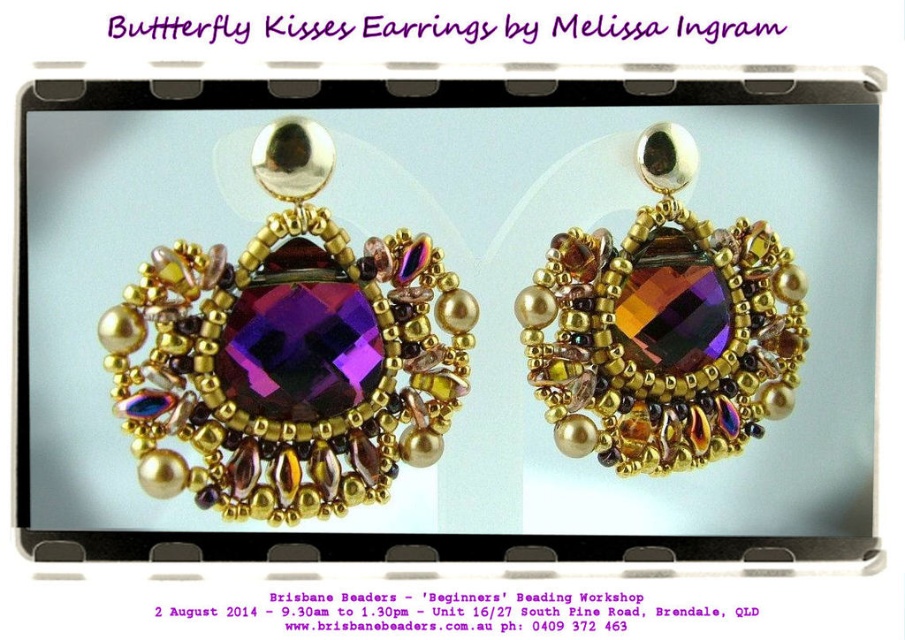
Question: Is purple faceted gemstone at center further to the viewer compared to iridescent glass heart at center?

Choices:
 (A) yes
 (B) no

Answer: (B)

Question: Can you confirm if purple faceted gemstone at center is positioned below iridescent glass heart at center?

Choices:
 (A) no
 (B) yes

Answer: (B)

Question: Can you confirm if purple faceted gemstone at center is positioned to the left of iridescent glass heart at center?

Choices:
 (A) no
 (B) yes

Answer: (B)

Question: Among these objects, which one is farthest from the camera?

Choices:
 (A) purple faceted gemstone at center
 (B) iridescent glass heart at center

Answer: (B)

Question: Among these objects, which one is nearest to the camera?

Choices:
 (A) purple faceted gemstone at center
 (B) iridescent glass heart at center

Answer: (A)